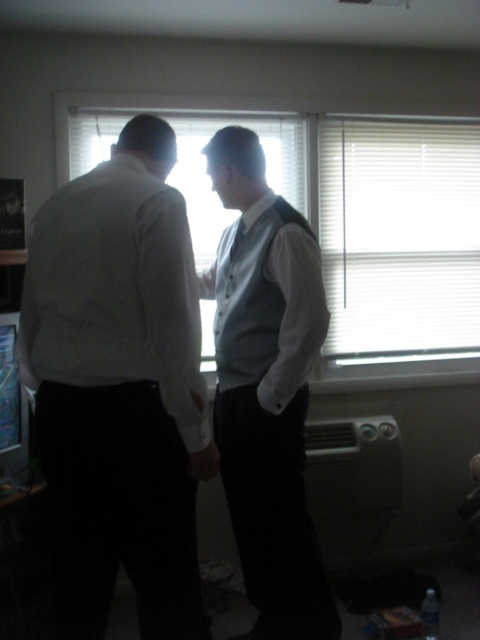
Does white blinds at upper center come behind silky white tie at center?

Yes, it is behind silky white tie at center.

Between point (431, 179) and point (240, 227), which one is positioned in front?

Positioned in front is point (240, 227).

Between point (377, 337) and point (229, 257), which one is positioned in front?

Point (229, 257)

Identify the location of white blinds at upper center. Image resolution: width=480 pixels, height=640 pixels. (399, 234).

Is white matte vest at center smaller than gray fabric vest at center?

No.

Which of these two, white matte vest at center or gray fabric vest at center, stands taller?

With more height is white matte vest at center.

Does point (240, 252) come closer to viewer compared to point (219, 266)?

Yes, point (240, 252) is closer to viewer.

Where is `white matte vest at center`? This screenshot has width=480, height=640. white matte vest at center is located at coordinates (266, 388).

Who is taller, matte white shirt at left or white matte vest at center?

With more height is white matte vest at center.

Does matte white shirt at left have a larger size compared to white matte vest at center?

Actually, matte white shirt at left might be smaller than white matte vest at center.

From the picture: Who is more distant from viewer, (x=73, y=520) or (x=245, y=300)?

Point (x=245, y=300)

Identify the location of matte white shirt at left. (119, 387).